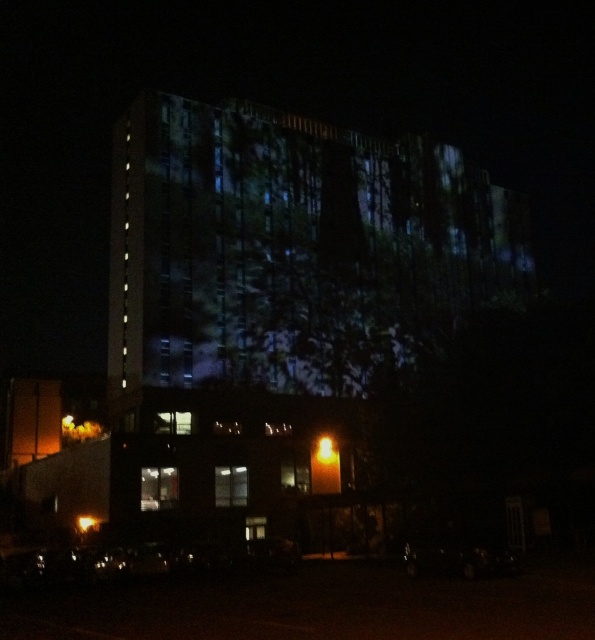
Is point (330, 442) more distant than point (93, 518)?

Yes, point (330, 442) is farther from viewer.

Which is below, bright orange light at center or amber glass light at lower left?

Positioned lower is amber glass light at lower left.

Who is more distant from viewer, (x=327, y=460) or (x=87, y=516)?

Point (x=327, y=460)

At what (x,y) coordinates should I click in order to perform the action: click on bright orange light at center. Please return your answer as a coordinate pair (x, y). Looking at the image, I should click on (325, 451).